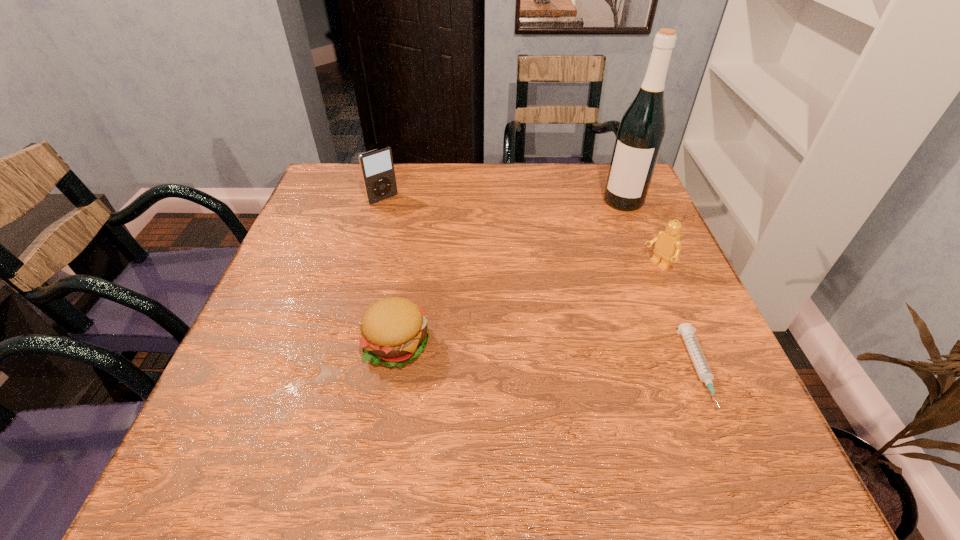
The width and height of the screenshot is (960, 540). What are the coordinates of `vacant spot on the desktop that is between the hamburger and the shortest object and is positioned on the front-facing side of the second tallest object` in the screenshot? It's located at (540, 356).

Identify the location of vacant space on the desktop that is between the hamburger and the syringe and is positioned on the face of the third farthest object. (517, 355).

Where is `free spot on the desktop that is between the hamburger and the syringe and is positioned on the label of the tallest object`? The image size is (960, 540). free spot on the desktop that is between the hamburger and the syringe and is positioned on the label of the tallest object is located at coordinates (537, 356).